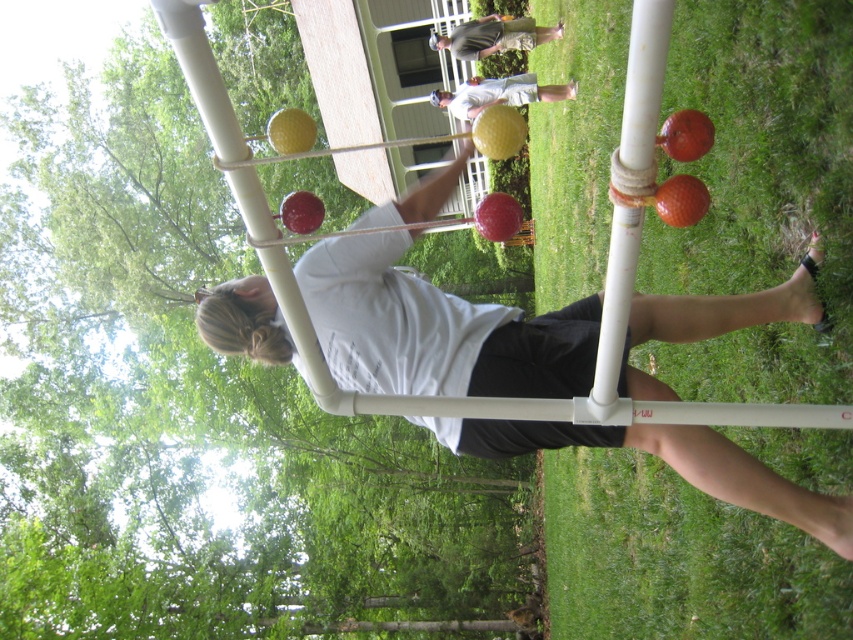
Question: Does white matte shirt at center come behind light gray shirt at upper center?

Choices:
 (A) yes
 (B) no

Answer: (B)

Question: Among these objects, which one is nearest to the camera?

Choices:
 (A) matte white shirt at center
 (B) light gray shirt at upper center
 (C) white matte shirt at center

Answer: (C)

Question: Which point is closer to the camera?

Choices:
 (A) click(x=537, y=92)
 (B) click(x=428, y=38)

Answer: (A)

Question: Is white matte shirt at center to the right of light gray shirt at upper center from the viewer's perspective?

Choices:
 (A) yes
 (B) no

Answer: (B)

Question: Considering the relative positions of white matte shirt at center and light gray shirt at upper center in the image provided, where is white matte shirt at center located with respect to light gray shirt at upper center?

Choices:
 (A) left
 (B) right

Answer: (A)

Question: Which point is closer to the camera taking this photo?

Choices:
 (A) (445, 100)
 (B) (442, 170)

Answer: (B)